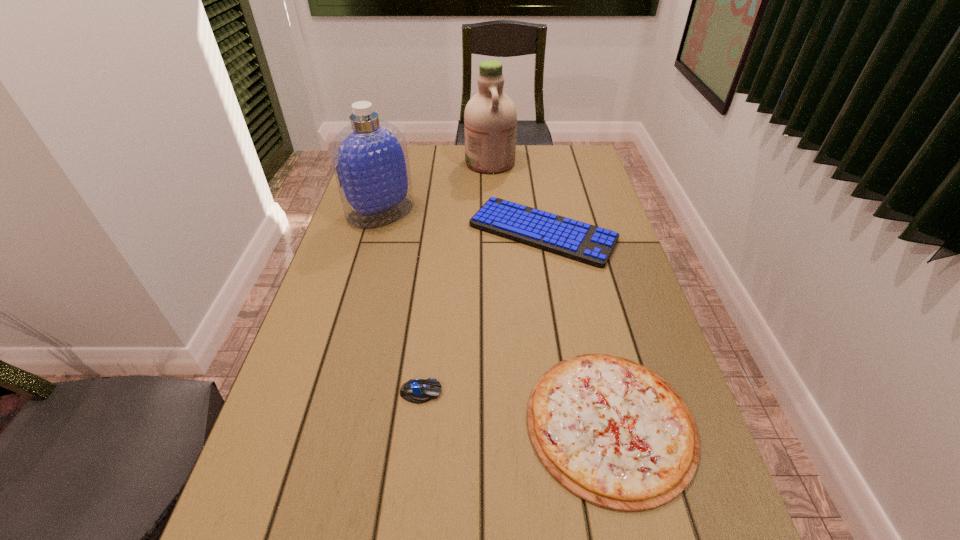
Find the location of a particular element. free space between the nearer cleansing agent and the computer keyboard is located at coordinates (462, 222).

I want to click on free spot between the farthest object and the fourth object from right to left, so click(x=456, y=277).

Locate an element on the screen. object that can be found as the fourth closest to the pizza is located at coordinates (490, 118).

Identify which object is the nearest to the computer keyboard. Please provide its 2D coordinates. Your answer should be formatted as a tuple, i.e. [(x, y)], where the tuple contains the x and y coordinates of a point satisfying the conditions above.

[(490, 118)]

Identify the location of vacant space that satisfies the following two spatial constraints: 1. on the button side of the second object from left to right; 2. on the back side of the shortest object. (418, 423).

Where is `vacant space that satisfies the following two spatial constraints: 1. on the front side of the computer keyboard; 2. on the left side of the shortest object`? The height and width of the screenshot is (540, 960). vacant space that satisfies the following two spatial constraints: 1. on the front side of the computer keyboard; 2. on the left side of the shortest object is located at coordinates click(x=575, y=423).

Locate an element on the screen. The height and width of the screenshot is (540, 960). free location that satisfies the following two spatial constraints: 1. on the button side of the computer mouse; 2. on the right side of the pizza is located at coordinates (418, 423).

Identify the location of vacant region that satisfies the following two spatial constraints: 1. on the front label of the farther cleansing agent; 2. on the left side of the computer keyboard. The width and height of the screenshot is (960, 540). (492, 232).

Where is `vacant space that satisfies the following two spatial constraints: 1. on the button side of the pizza; 2. on the right side of the computer mouse`? This screenshot has height=540, width=960. vacant space that satisfies the following two spatial constraints: 1. on the button side of the pizza; 2. on the right side of the computer mouse is located at coordinates coord(418,423).

The image size is (960, 540). Identify the location of free region that satisfies the following two spatial constraints: 1. on the front label of the farthest object; 2. on the right side of the shortest object. (499, 423).